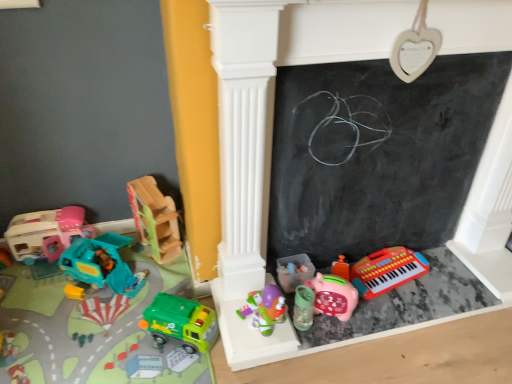
Locate an element on the screen. vacant area to the right of rubberized plastic keyboard at lower right, which is the 7th toy in left-to-right order is located at coordinates (455, 282).